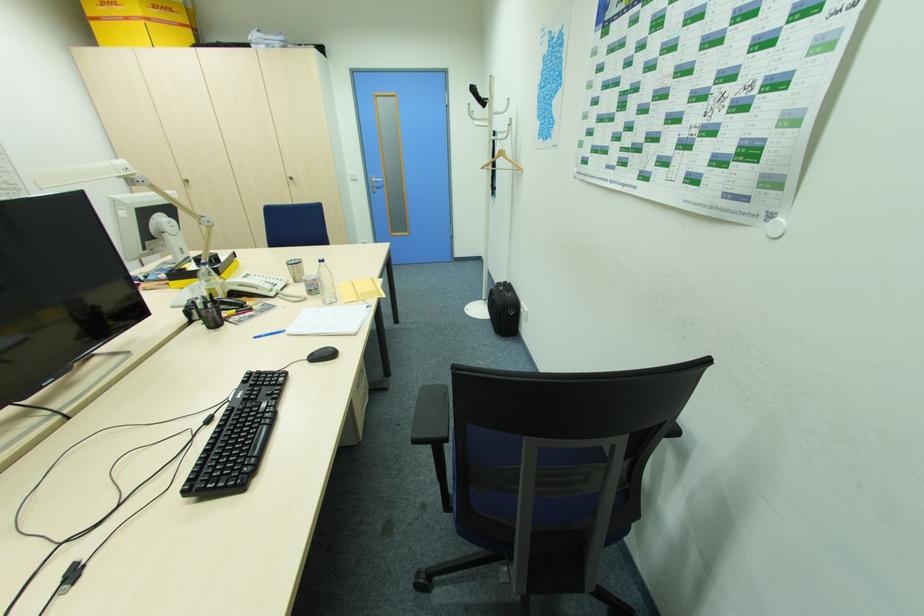
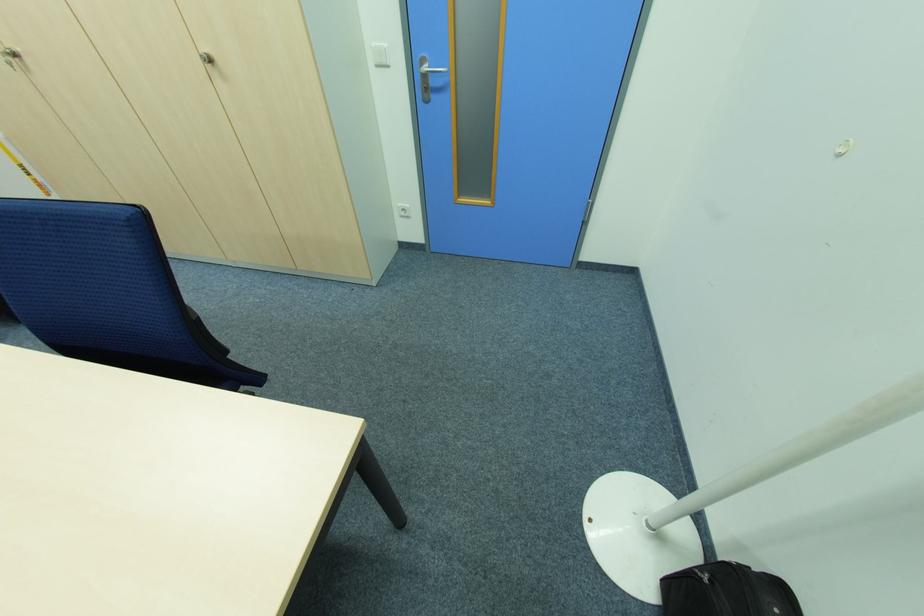
Where in the second image is the point corresponding to [295,179] from the first image?

(213, 62)